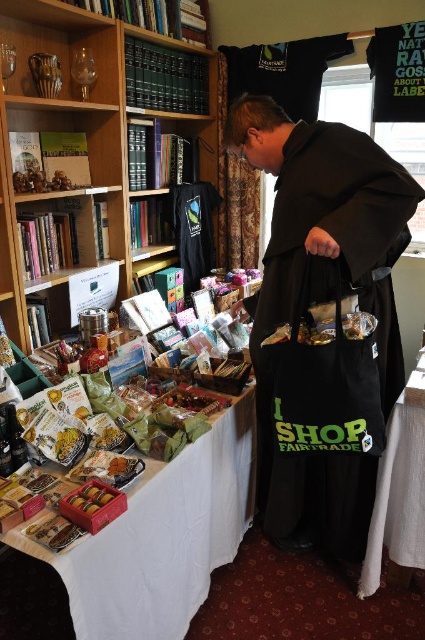
You are a customer in a fair trade shop and want to place a small gift card on the wooden bookcase at upper left and the black matte robe at center. Which object allows you to place the gift card higher up?

The black matte robe at center is taller than the wooden bookcase at upper left, so you can place the gift card higher up on the black matte robe at center.

You are standing in the fair trade shop and see two points marked on the image. The first point is at coordinates point (x=74, y=154) and the second is at point (x=348, y=480). Which point is closer to you?

Point (x=74, y=154) is closer to you because it is further to the camera than point (x=348, y=480).